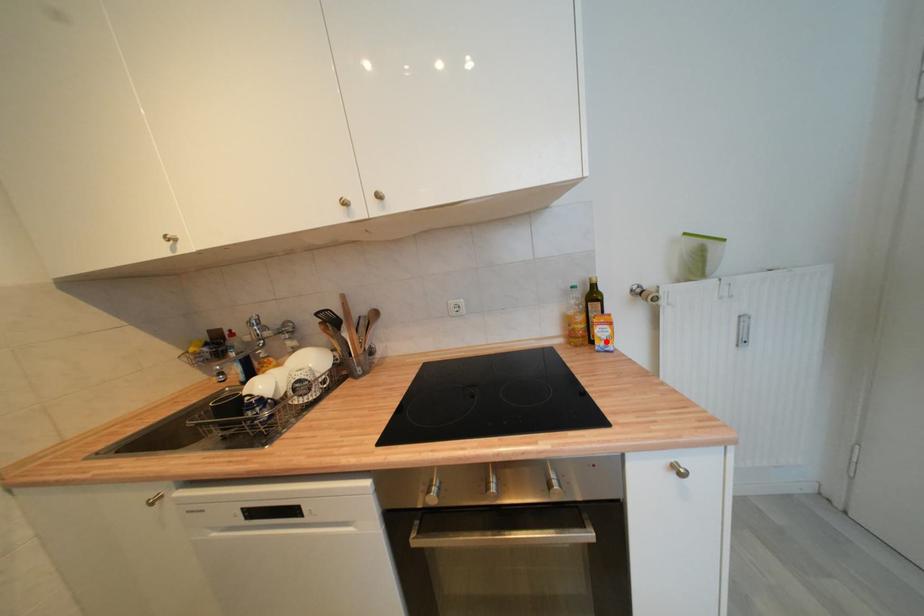
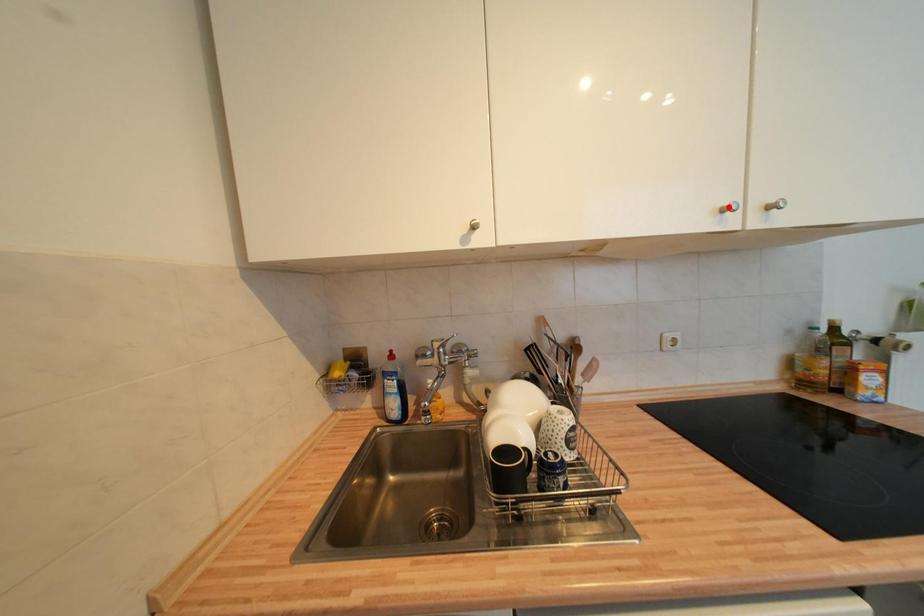
I am providing you with two images of the same scene from different viewpoints. A red point is marked on the first image and another point is marked on the second image. Does the point marked in image1 correspond to the same location as the one in image2?

No